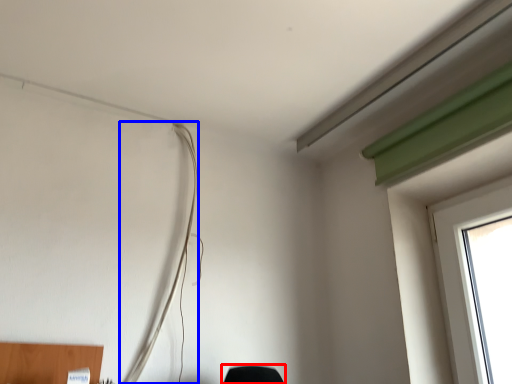
Question: Which object appears farthest to the camera in this image, furniture (highlighted by a red box) or wire (highlighted by a blue box)?

Choices:
 (A) furniture
 (B) wire

Answer: (B)